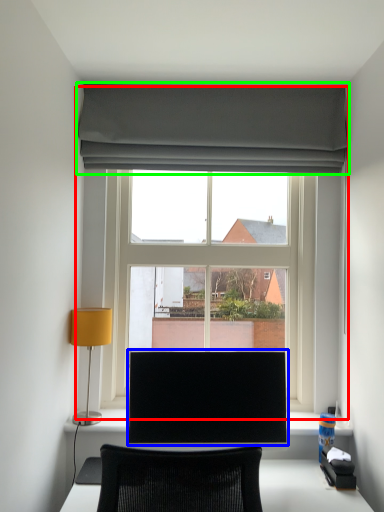
Question: Which object is positioned farthest from window (highlighted by a red box)? Select from computer monitor (highlighted by a blue box) and curtain (highlighted by a green box).

Choices:
 (A) computer monitor
 (B) curtain

Answer: (A)